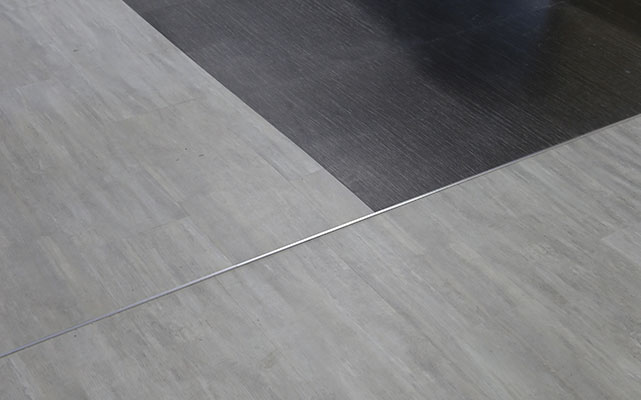
At what (x,y) coordinates should I click in order to perform the action: click on dark shadow on dark brown laminate flooring. Please return your answer as a coordinate pair (x, y). Looking at the image, I should click on (486, 51).